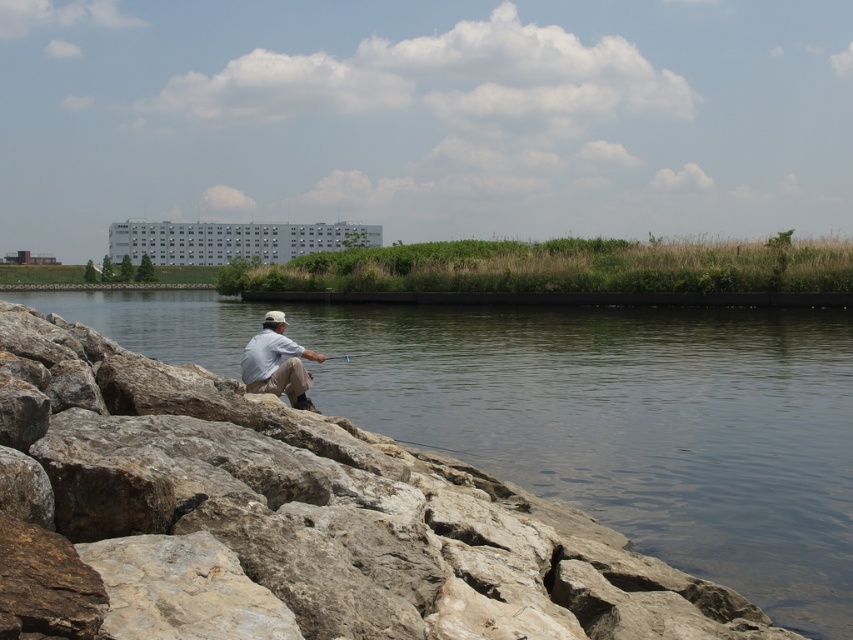
Can you confirm if clear water at lower left is positioned below light blue cotton shirt at center?

Actually, clear water at lower left is above light blue cotton shirt at center.

Is point (654, 460) more distant than point (247, 385)?

No.

Which is in front, point (637, 541) or point (273, 388)?

Point (637, 541)

Find the location of a particular element. The image size is (853, 640). clear water at lower left is located at coordinates (633, 426).